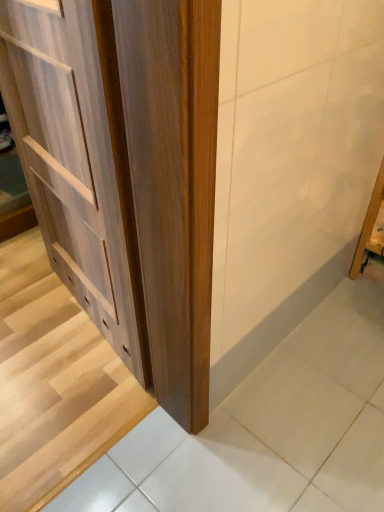
Find the location of a particular element. This screenshot has width=384, height=512. free spot in front of light wood cabinet at left is located at coordinates (63, 393).